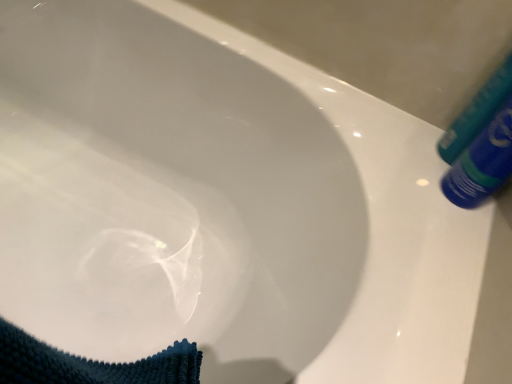
In order to click on free space to the left of blue plastic tube at upper right, the 2th tube positioned from the bottom in this screenshot , I will do `click(381, 128)`.